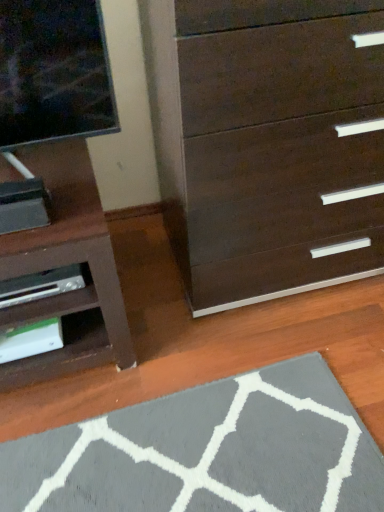
I want to click on free space to the back side of gray soft rug at lower center, so click(217, 327).